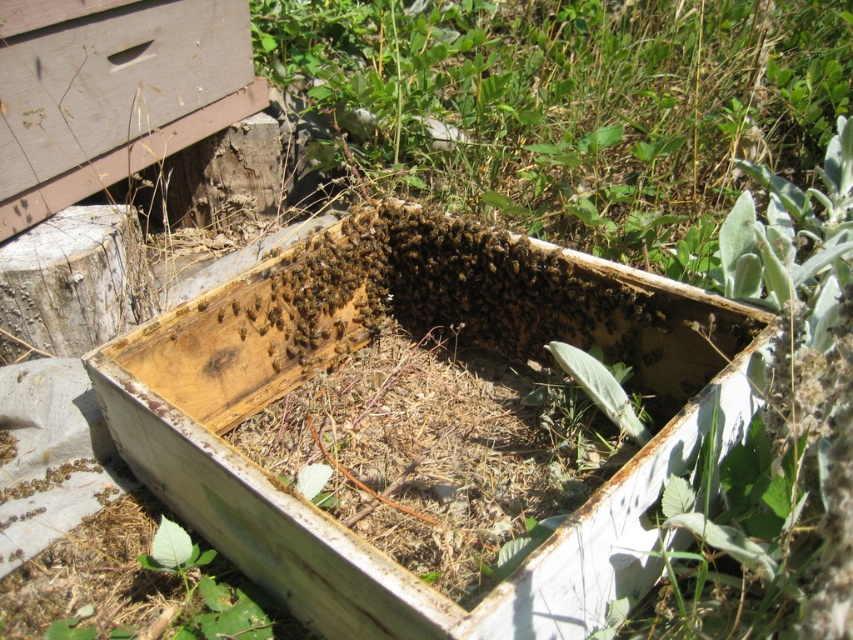
From the picture: You are a beekeeper inspecting the beehive. You notice the weathered wood beehive at center and the translucent yellowish honeycomb at center. Which object is positioned lower in the image?

The weathered wood beehive at center is positioned below the translucent yellowish honeycomb at center, so it is lower in the image.

You are a beekeeper trying to inspect the weathered wood beehive at center and the translucent yellowish honeycomb at center. You have a 20 inch long tool. Can you reach both objects with your tool without moving closer?

The weathered wood beehive at center is 21.55 inches away from the translucent yellowish honeycomb at center. Since the tool is only 20 inches long, it is too short to reach both objects simultaneously. You will need a longer tool or move closer to access them.

You are a beekeeper inspecting the beehive. You notice the weathered wood beehive at center and the translucent yellowish honeycomb at center. Which object would you need to handle with more care to avoid damaging the smaller one?

The weathered wood beehive at center is larger in size than the translucent yellowish honeycomb at center. Therefore, you should handle the weathered wood beehive at center with more care to avoid damaging the smaller translucent yellowish honeycomb at center.